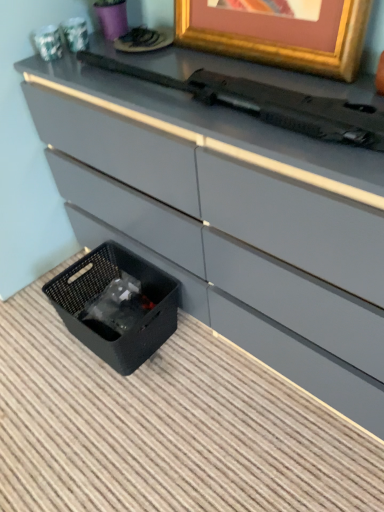
Question: Is black woven basket at lower left in front of or behind gold metallic picture frame at upper center in the image?

Choices:
 (A) behind
 (B) front

Answer: (A)

Question: Considering the positions of black woven basket at lower left and gold metallic picture frame at upper center in the image, is black woven basket at lower left wider or thinner than gold metallic picture frame at upper center?

Choices:
 (A) thin
 (B) wide

Answer: (B)

Question: Which object is the farthest from the gold metallic picture frame at upper center?

Choices:
 (A) black plastic typewriter at upper center
 (B) black woven basket at lower left

Answer: (B)

Question: Which object is positioned farthest from the black woven basket at lower left?

Choices:
 (A) black plastic typewriter at upper center
 (B) gold metallic picture frame at upper center

Answer: (B)